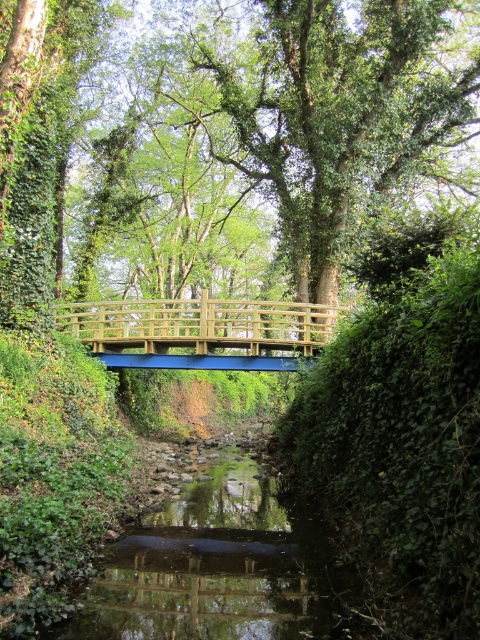
Question: Which point is farther to the camera?

Choices:
 (A) wooden bridge at center
 (B) green leafy tree at center

Answer: (A)

Question: Which point is closer to the camera?

Choices:
 (A) green leafy tree at center
 (B) wooden bridge at center

Answer: (A)

Question: Is green leafy tree at center above wooden bridge at center?

Choices:
 (A) yes
 (B) no

Answer: (A)

Question: Is green leafy tree at center to the left of wooden bridge at center from the viewer's perspective?

Choices:
 (A) yes
 (B) no

Answer: (B)

Question: Which point is farther to the camera?

Choices:
 (A) green leafy tree at center
 (B) wooden bridge at center

Answer: (B)

Question: Does green leafy tree at center have a greater width compared to wooden bridge at center?

Choices:
 (A) no
 (B) yes

Answer: (B)